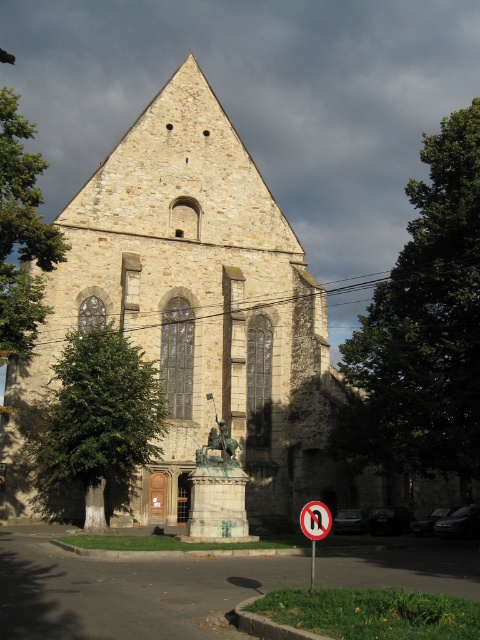
What do you see at coordinates (314, 525) in the screenshot? I see `white plastic no u-turn sign at lower right` at bounding box center [314, 525].

Is white plastic no u-turn sign at lower right below black plastic sign at center?

Indeed, white plastic no u-turn sign at lower right is positioned under black plastic sign at center.

Does point (310, 529) come behind point (322, 515)?

No, it is not.

The image size is (480, 640). What are the coordinates of `white plastic no u-turn sign at lower right` in the screenshot? It's located at (314, 525).

Does stone church at center have a greater width compared to black plastic sign at center?

Yes.

Find the location of a particular element. stone church at center is located at coordinates (201, 307).

Does stone church at center appear on the left side of white plastic no u-turn sign at lower right?

Yes, stone church at center is to the left of white plastic no u-turn sign at lower right.

The width and height of the screenshot is (480, 640). I want to click on stone church at center, so click(x=201, y=307).